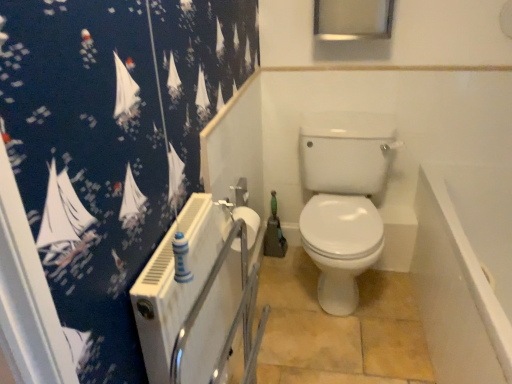
Question: Is white matte toilet paper at center inside or outside of white glossy toilet at center?

Choices:
 (A) outside
 (B) inside

Answer: (A)

Question: From a real-world perspective, is white matte toilet paper at center positioned above or below white glossy toilet at center?

Choices:
 (A) below
 (B) above

Answer: (B)

Question: Which is farther from the white glossy bathtub at lower right?

Choices:
 (A) white matte toilet paper at center
 (B) white glossy toilet at center

Answer: (A)

Question: Which of these objects is positioned closest to the white glossy toilet at center?

Choices:
 (A) white glossy bathtub at lower right
 (B) white matte toilet paper at center

Answer: (A)